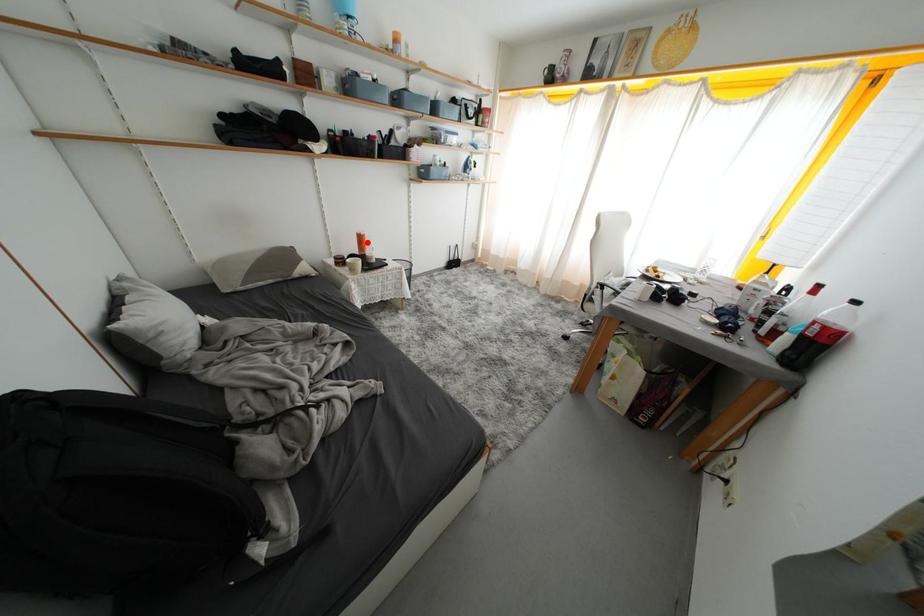
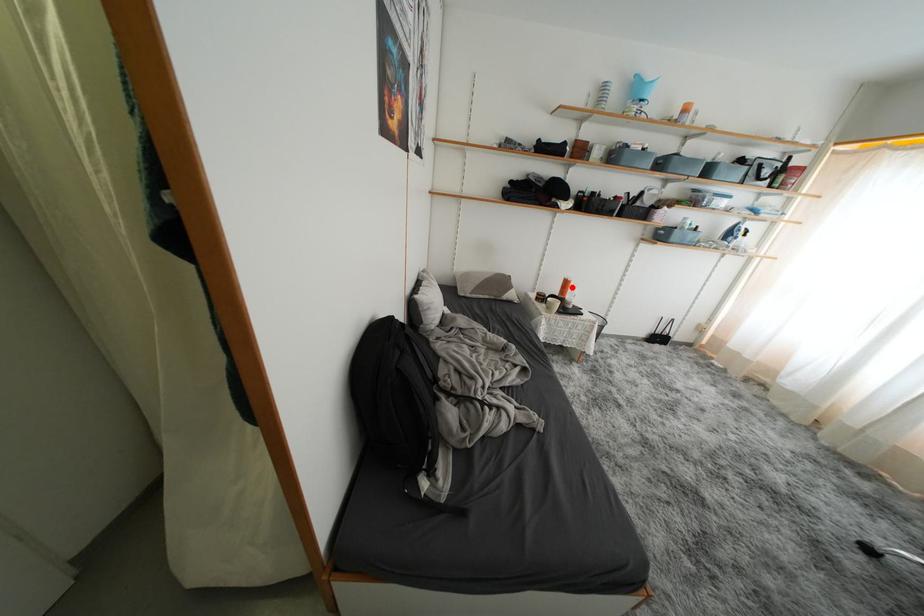
I am providing you with two images of the same scene from different viewpoints. A red point is marked on the first image and another point is marked on the second image. Is the marked point in image1 the same physical position as the marked point in image2?

Yes